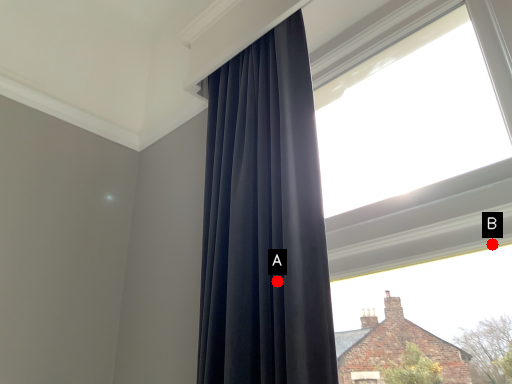
Question: Two points are circled on the image, labeled by A and B beside each circle. Which point is closer to the camera?

Choices:
 (A) A is closer
 (B) B is closer

Answer: (B)